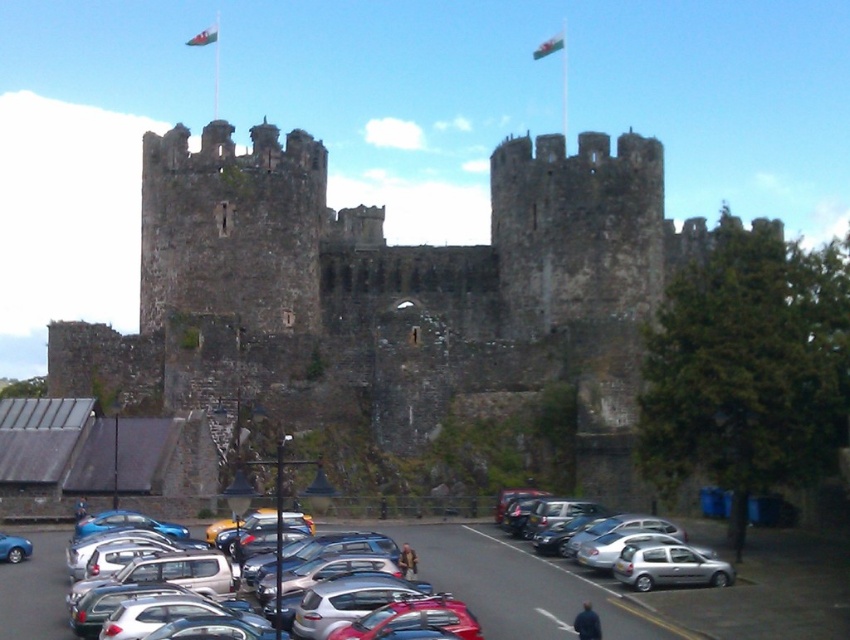
Question: Which point is closer to the camera?

Choices:
 (A) silver metallic car at lower center
 (B) blue metallic car at lower left

Answer: (A)

Question: Which point appears closest to the camera in this image?

Choices:
 (A) (650, 588)
 (B) (17, 538)
 (C) (588, 547)
 (D) (211, 531)

Answer: (A)

Question: Is metallic cars at lower center above silver metallic car at lower center?

Choices:
 (A) yes
 (B) no

Answer: (B)

Question: Can you confirm if metallic cars at lower center is smaller than blue metallic car at lower left?

Choices:
 (A) yes
 (B) no

Answer: (B)

Question: Among these points, which one is nearest to the camera?

Choices:
 (A) (599, 520)
 (B) (537, 45)

Answer: (A)

Question: Can you confirm if silver metallic car at lower center is bigger than blue metallic car at lower left?

Choices:
 (A) no
 (B) yes

Answer: (B)